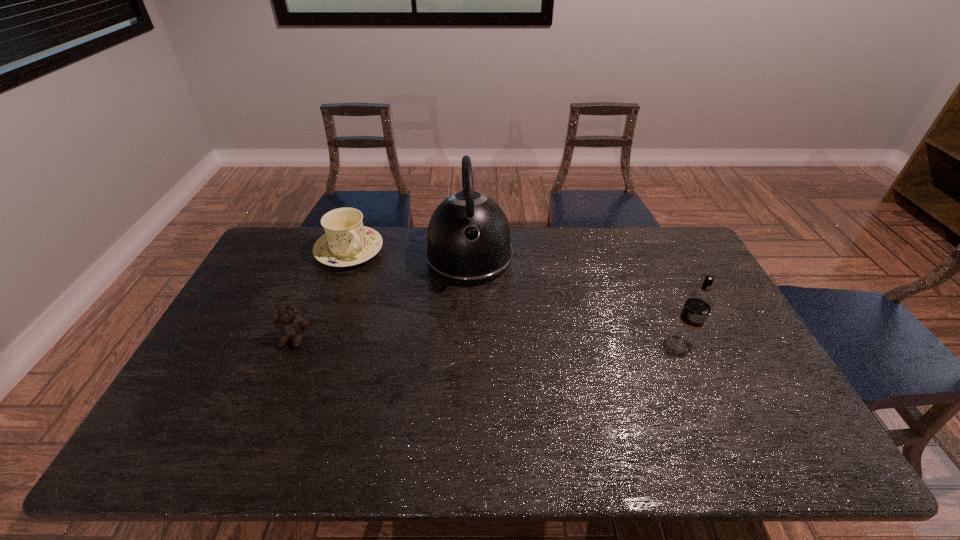
At what (x,y) coordinates should I click in order to perform the action: click on vacant space on the desktop that is between the teddy bear and the vodka and is positioned on the spout of the second object from right to left. Please return your answer as a coordinate pair (x, y). Looking at the image, I should click on (477, 340).

This screenshot has height=540, width=960. What are the coordinates of `vacant space on the desktop that is between the teddy bear and the vodka and is positioned on the handle side of the chinaware` in the screenshot? It's located at (438, 340).